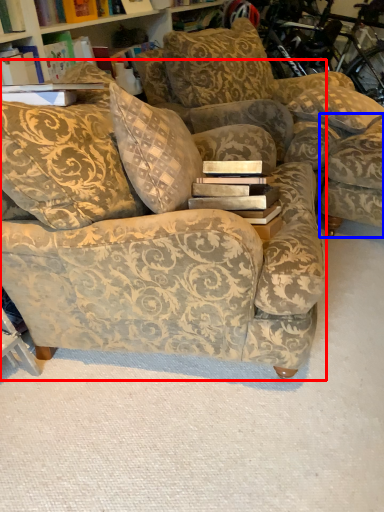
Question: Among these objects, which one is farthest to the camera, studio couch (highlighted by a red box) or swivel chair (highlighted by a blue box)?

Choices:
 (A) studio couch
 (B) swivel chair

Answer: (B)